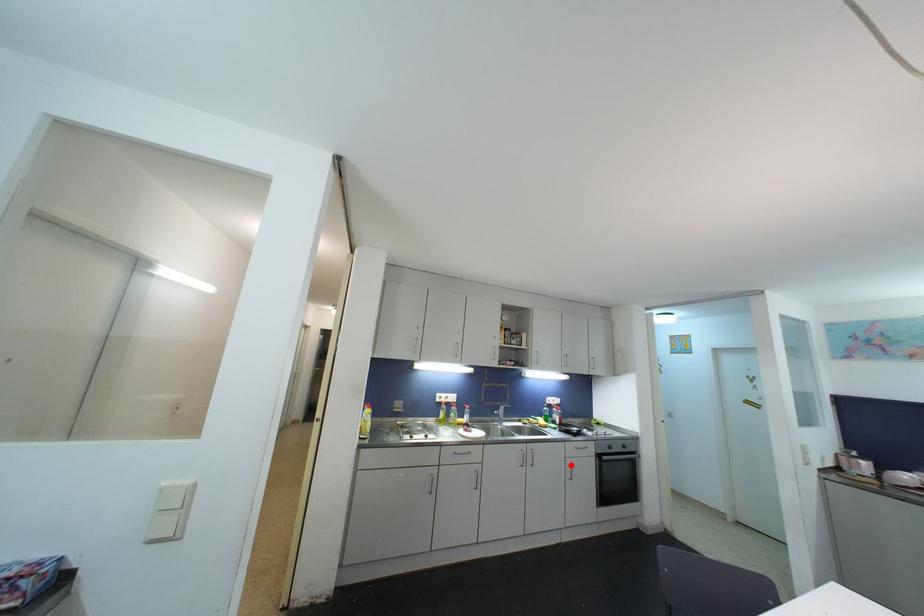
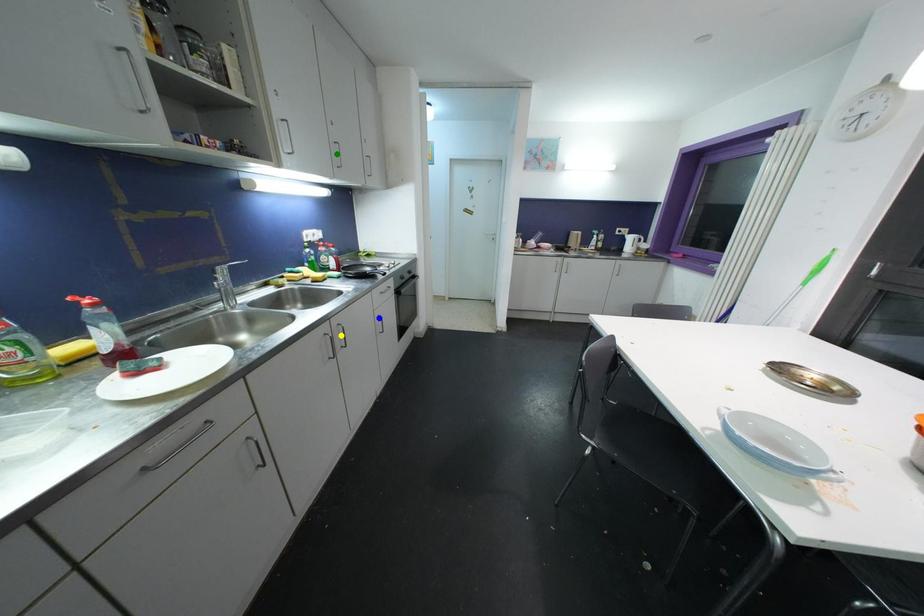
Question: I am providing you with two images of the same scene from different viewpoints. A red point is marked on the first image. You are given multiple points on the second image. In image 2, which mark is for the same physical point as the one in image 1?

Choices:
 (A) green point
 (B) yellow point
 (C) blue point

Answer: (C)